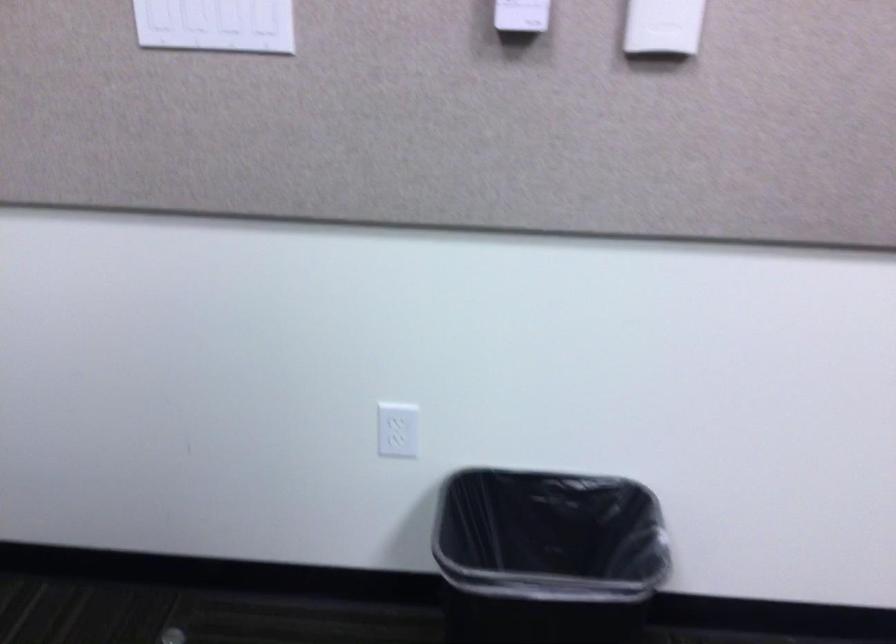
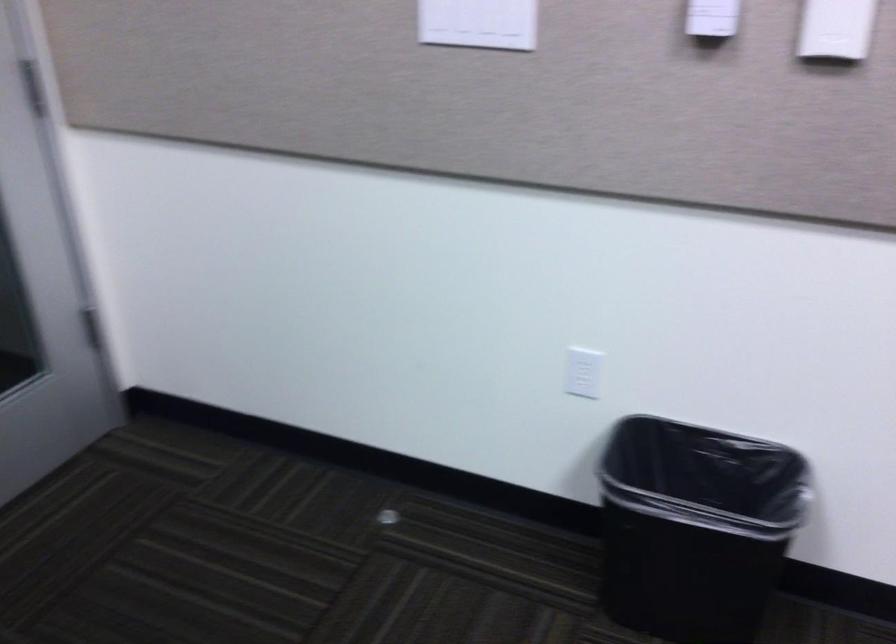
Question: The camera is either moving clockwise (left) or counter-clockwise (right) around the object. The first image is from the beginning of the video and the second image is from the end. Is the camera moving left or right when shooting the video?

Choices:
 (A) Left
 (B) Right

Answer: (B)